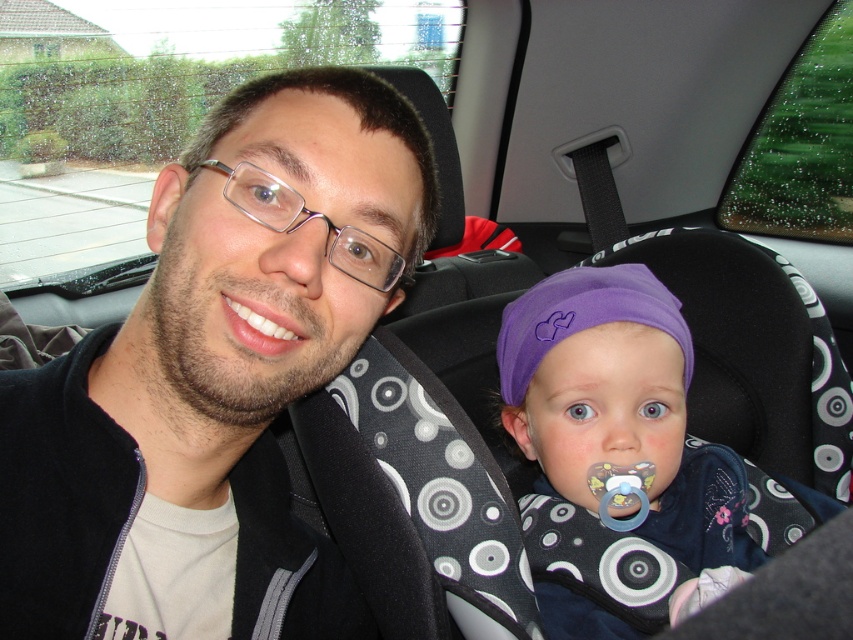
Is matte black jacket at center smaller than purple fabric headband at center?

No, matte black jacket at center is not smaller than purple fabric headband at center.

Looking at this image, does matte black jacket at center appear over purple fabric headband at center?

Yes, matte black jacket at center is above purple fabric headband at center.

Does point (274, 616) come behind point (645, 406)?

No, it is not.

You are a GUI agent. You are given a task and a screenshot of the screen. Output one action in this format:
    pyautogui.click(x=<x>, y=<y>)
    Task: Click on the matte black jacket at center
    This screenshot has height=640, width=853.
    Given the screenshot: What is the action you would take?
    pyautogui.click(x=218, y=364)